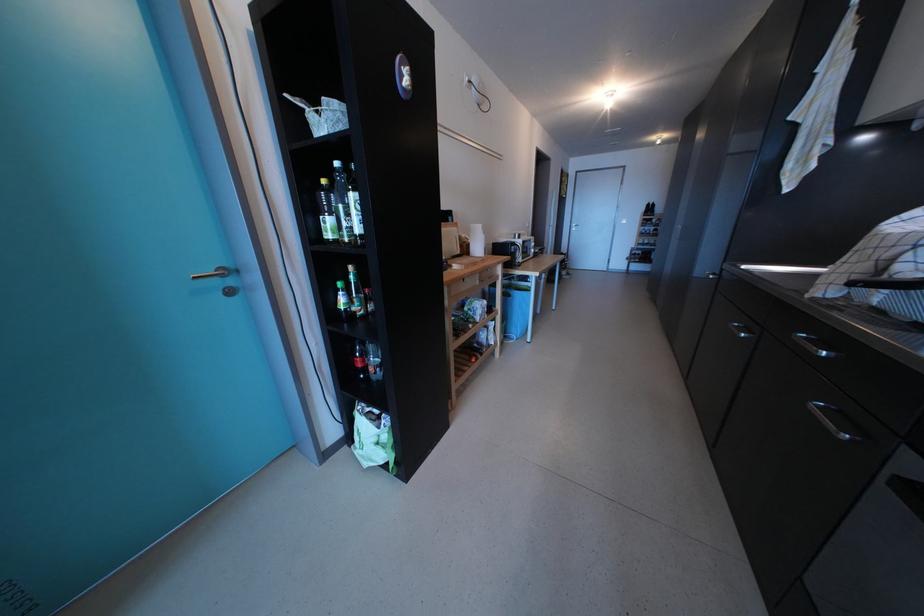
Find where to pull the door handle. Please return your answer as a coordinate pair (x, y).

(214, 273)